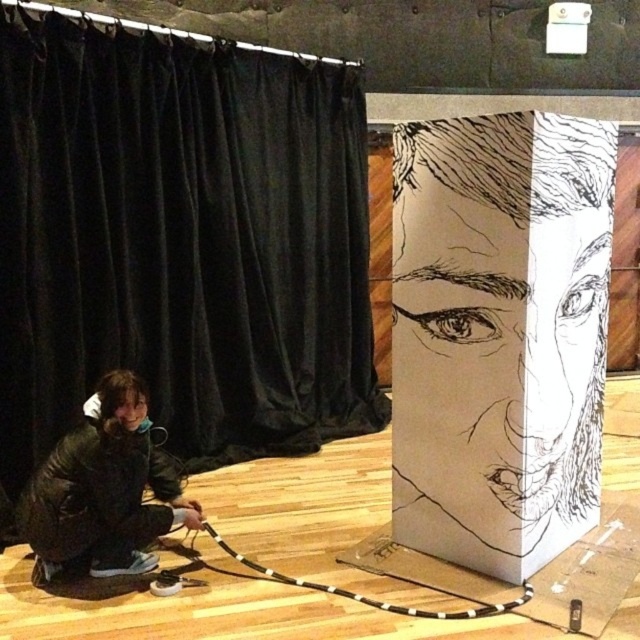
You are an art installer who needs to display both the black velvet curtain at center and the white paper drawing at center in a gallery. According to the scene, which object is covering the other one?

The black velvet curtain at center is positioned over the white paper drawing at center, so it is covering the drawing.

You are a stagehand setting up for a play. You have to decide whether the black velvet curtain at center can be hung using a standard curtain rod that fits a width of 1.2 meters. The black leather jacket at lower left is 0.8 meters wide. Can the curtain be hung without needing a wider rod?

The black velvet curtain at center might be wider than black leather jacket at lower left, which is 0.8 meters wide. If the curtain is wider than 1.2 meters, it won provided information about the curtain width. The answer should use the objects description which says the curtain might be wider than the jacket. Since the jacket is 0.8m, the curtain could be wider than that, but the rod is 1.2m. So if the curtain is between 0.8m and 1.2m, it fits. If wider than 1.2m, it won. But since the description only say

You are an interior designer inspecting the room. You notice the black velvet curtain at center and the black leather jacket at lower left. Which object is located to the right of the other?

The black velvet curtain at center is positioned on the right side of black leather jacket at lower left.